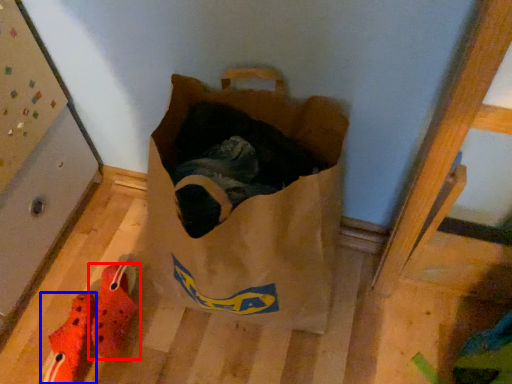
Question: Which object is closer to the camera taking this photo, footwear (highlighted by a red box) or footwear (highlighted by a blue box)?

Choices:
 (A) footwear
 (B) footwear

Answer: (B)